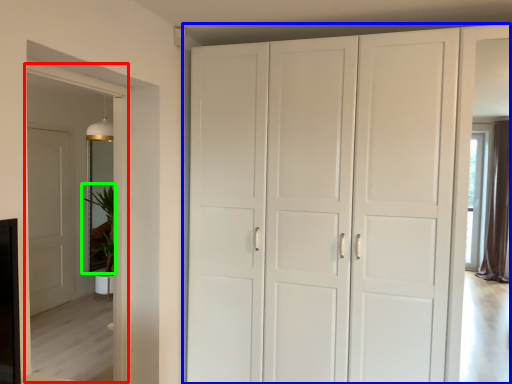
Question: Estimate the real-world distances between objects in this image. Which object is closer to glass door (highlighted by a red box), cupboard (highlighted by a blue box) or plant (highlighted by a green box)?

Choices:
 (A) cupboard
 (B) plant

Answer: (A)